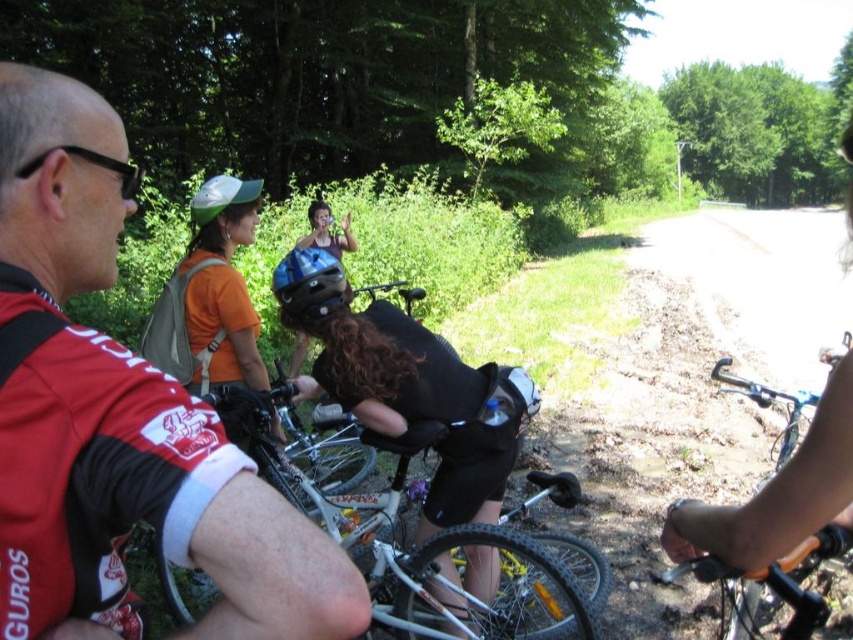
Is red jersey at center to the left of matte black helmet at center from the viewer's perspective?

Correct, you'll find red jersey at center to the left of matte black helmet at center.

Which of these two, red jersey at center or matte black helmet at center, stands taller?

matte black helmet at center is taller.

You are a GUI agent. You are given a task and a screenshot of the screen. Output one action in this format:
    pyautogui.click(x=<x>, y=<y>)
    Task: Click on the red jersey at center
    
    Given the screenshot: What is the action you would take?
    pyautogui.click(x=146, y=506)

The width and height of the screenshot is (853, 640). Identify the location of red jersey at center. (146, 506).

Does red jersey at center have a greater width compared to blue matte helmet at center?

Indeed, red jersey at center has a greater width compared to blue matte helmet at center.

Does red jersey at center have a greater height compared to blue matte helmet at center?

Correct, red jersey at center is much taller as blue matte helmet at center.

I want to click on red jersey at center, so click(x=146, y=506).

Where is `red jersey at center`? red jersey at center is located at coordinates (146, 506).

Between silver metallic bicycle at center and blue matte helmet at center, which one appears on the right side from the viewer's perspective?

From the viewer's perspective, silver metallic bicycle at center appears more on the right side.

Who is more forward, (432, 440) or (276, 272)?

Point (432, 440) is in front.

Where is `silver metallic bicycle at center`? Image resolution: width=853 pixels, height=640 pixels. silver metallic bicycle at center is located at coordinates (x=425, y=541).